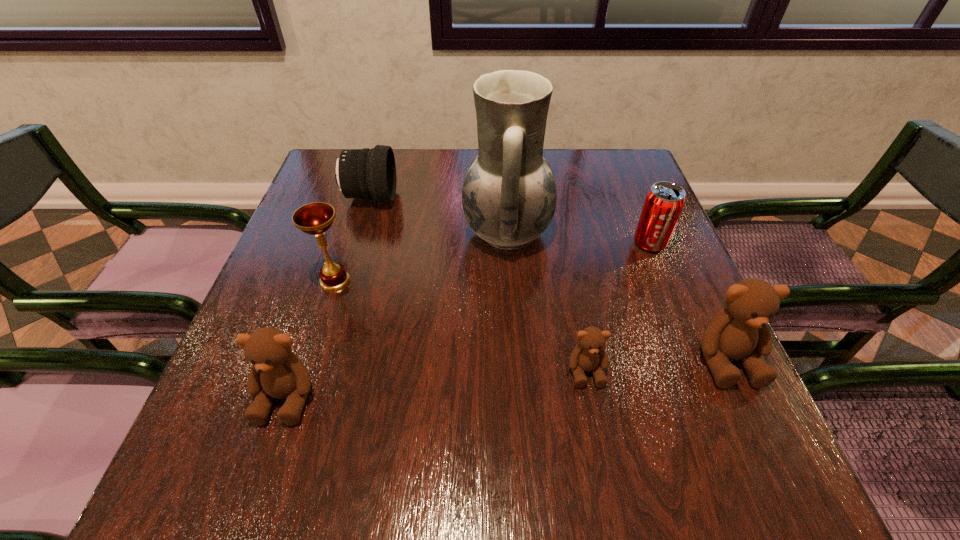
Locate an element on the screen. The image size is (960, 540). vacant space located on the right of the chalice is located at coordinates (431, 280).

At what (x,y) coordinates should I click in order to perform the action: click on free space located 0.050m on the front-facing side of the tallest object. Please return your answer as a coordinate pair (x, y). The height and width of the screenshot is (540, 960). Looking at the image, I should click on (443, 232).

The image size is (960, 540). I want to click on blank space located 0.400m on the front-facing side of the tallest object, so click(299, 232).

This screenshot has height=540, width=960. I want to click on vacant space located 0.300m on the front-facing side of the tallest object, so click(340, 232).

The width and height of the screenshot is (960, 540). I want to click on vacant area situated 0.340m on the front of the soda can, so click(708, 387).

Where is `object at the far edge`? object at the far edge is located at coordinates (x=366, y=173).

Find the location of a particular element. This screenshot has height=540, width=960. teddy bear situated at the left edge is located at coordinates (277, 372).

Identify the location of telephoto lens located at the left edge. (366, 173).

Locate an element on the screen. This screenshot has height=540, width=960. chalice that is at the left edge is located at coordinates (316, 218).

Where is `teddy bear present at the right edge`? teddy bear present at the right edge is located at coordinates (740, 332).